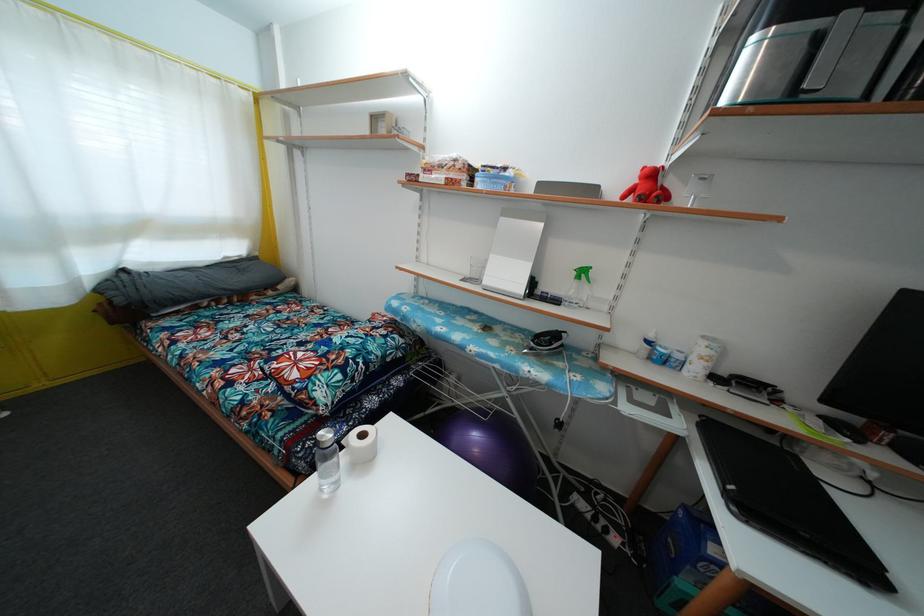
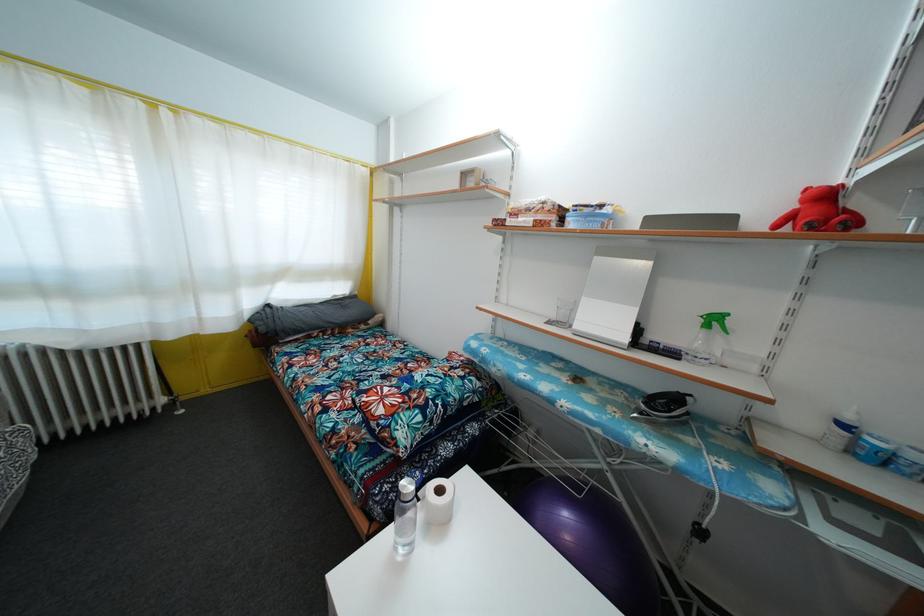
Where in the second image is the point corresponding to (261,261) from the first image?

(359, 300)